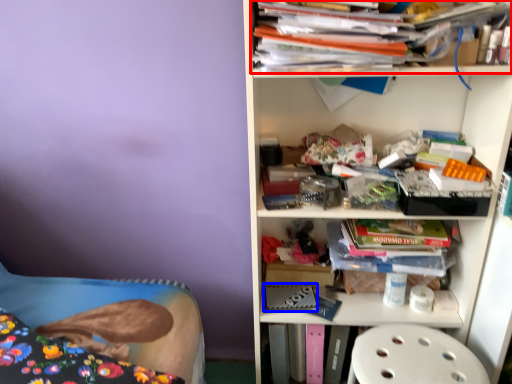
Question: Which object is closer to the camera taking this photo, book (highlighted by a red box) or paperback book (highlighted by a blue box)?

Choices:
 (A) book
 (B) paperback book

Answer: (A)